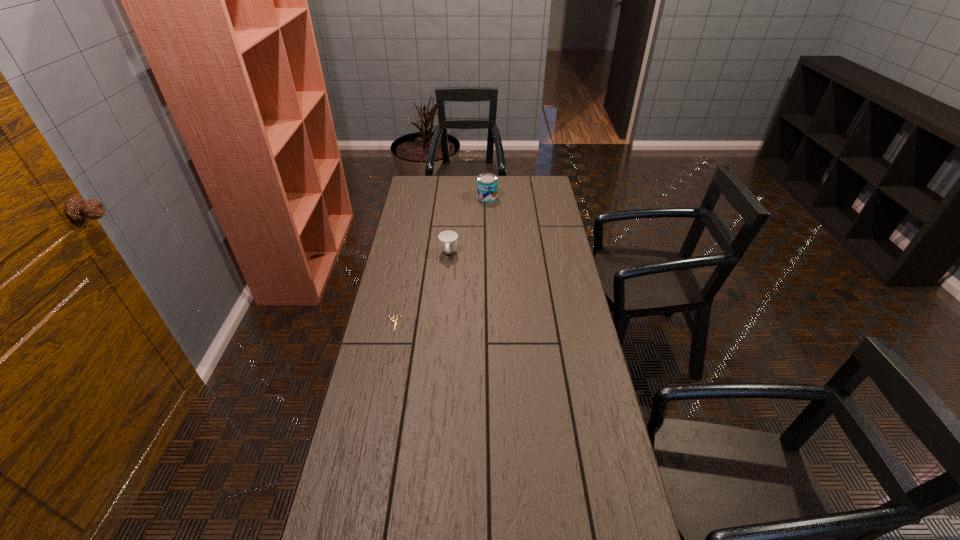
This screenshot has width=960, height=540. Identify the location of the rightmost object. point(487,184).

This screenshot has height=540, width=960. I want to click on the farthest object, so click(487, 184).

At what (x,y) coordinates should I click in order to perform the action: click on the second farthest object. Please return your answer as a coordinate pair (x, y). The width and height of the screenshot is (960, 540). Looking at the image, I should click on (448, 239).

You are a GUI agent. You are given a task and a screenshot of the screen. Output one action in this format:
    pyautogui.click(x=<x>, y=<y>)
    Task: Click on the second object from left to right
    Image resolution: width=960 pixels, height=540 pixels.
    Given the screenshot: What is the action you would take?
    pyautogui.click(x=448, y=239)

Identify the location of the leftmost object. Image resolution: width=960 pixels, height=540 pixels. (395, 322).

Where is `shears`? This screenshot has height=540, width=960. shears is located at coordinates (395, 322).

Identify the location of free location located 0.350m on the front of the rightmost object. (489, 244).

The width and height of the screenshot is (960, 540). What are the coordinates of `vacant space situated with the handle on the side of the second shortest object` in the screenshot? It's located at (443, 324).

This screenshot has height=540, width=960. I want to click on free space located on the back of the shears, so click(402, 282).

Find the location of a particular element. The image size is (960, 540). object at the far edge is located at coordinates (487, 184).